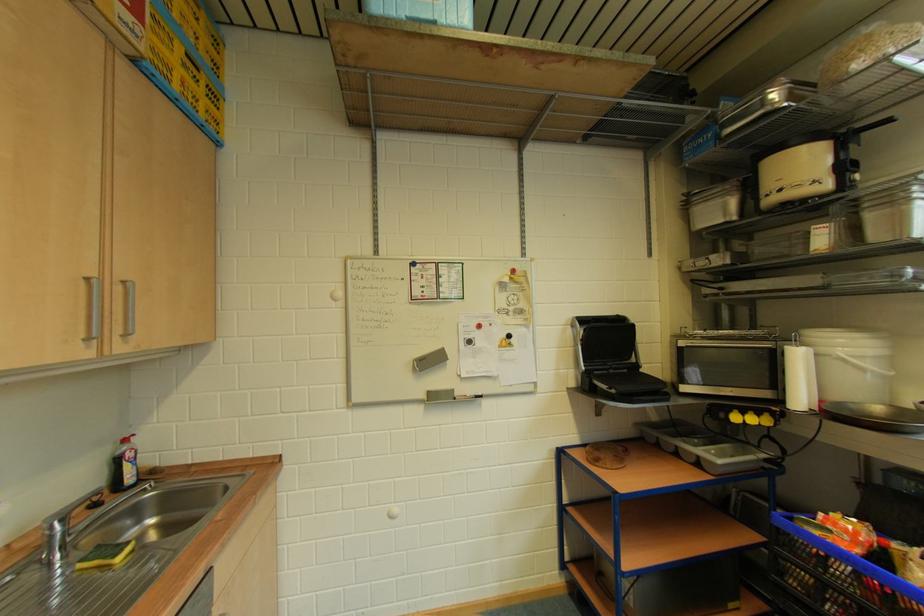
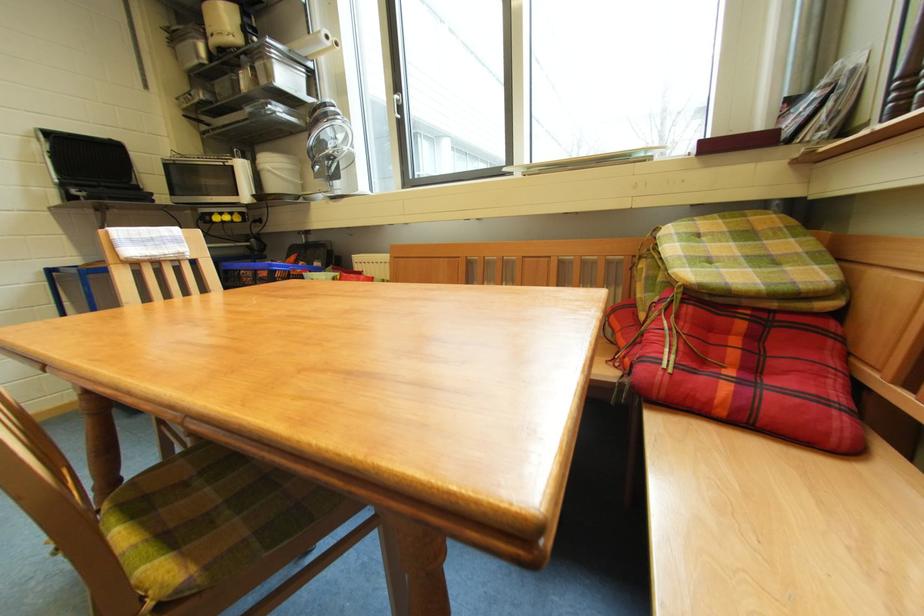
Question: I am providing you with two images of the same scene from different viewpoints. After the viewpoint changes to image2, which objects are now occluded?

Choices:
 (A) white plastic bucket
 (B) paper towel roll
 (C) blue plastic basket
 (D) none of these

Answer: (D)